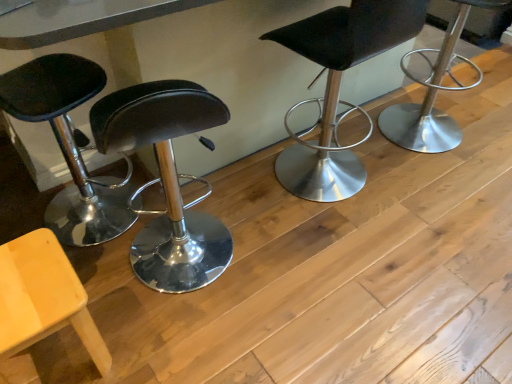
Question: Does polished silver stool at right, the first chair positioned from the right, have a lesser height compared to black leather stool at center, positioned as the 2th chair in right-to-left order?

Choices:
 (A) no
 (B) yes

Answer: (B)

Question: Is polished silver stool at right, the 4th chair in the left-to-right sequence, behind black leather stool at center, positioned as the 2th chair in right-to-left order?

Choices:
 (A) yes
 (B) no

Answer: (A)

Question: Is polished silver stool at right, the 4th chair in the left-to-right sequence, not close to black leather stool at center, positioned as the 2th chair in right-to-left order?

Choices:
 (A) no
 (B) yes

Answer: (A)

Question: Does polished silver stool at right, the 4th chair in the left-to-right sequence, have a larger size compared to black leather stool at center, positioned as the 2th chair in right-to-left order?

Choices:
 (A) yes
 (B) no

Answer: (B)

Question: Can you confirm if polished silver stool at right, the 4th chair in the left-to-right sequence, is wider than black leather stool at center, the 3th chair in the left-to-right sequence?

Choices:
 (A) yes
 (B) no

Answer: (A)

Question: Is point (342, 48) positioned closer to the camera than point (421, 147)?

Choices:
 (A) farther
 (B) closer

Answer: (B)

Question: Looking at the image, does black leather stool at center, positioned as the 2th chair in right-to-left order, seem bigger or smaller compared to polished silver stool at right, the first chair positioned from the right?

Choices:
 (A) big
 (B) small

Answer: (A)

Question: Is black leather stool at center, positioned as the 2th chair in right-to-left order, to the left or to the right of polished silver stool at right, the first chair positioned from the right, in the image?

Choices:
 (A) right
 (B) left

Answer: (B)

Question: In terms of height, does black leather stool at center, positioned as the 2th chair in right-to-left order, look taller or shorter compared to polished silver stool at right, the 4th chair in the left-to-right sequence?

Choices:
 (A) tall
 (B) short

Answer: (A)

Question: Looking at the image, does matte black stool at left, which appears as the 1th chair when viewed from the left, seem bigger or smaller compared to polished silver stool at right, the first chair positioned from the right?

Choices:
 (A) big
 (B) small

Answer: (A)

Question: From the image's perspective, is matte black stool at left, arranged as the fourth chair when viewed from the right, located above or below polished silver stool at right, the first chair positioned from the right?

Choices:
 (A) above
 (B) below

Answer: (B)

Question: Visually, is matte black stool at left, which appears as the 1th chair when viewed from the left, positioned to the left or to the right of polished silver stool at right, the 4th chair in the left-to-right sequence?

Choices:
 (A) right
 (B) left

Answer: (B)

Question: Is matte black stool at left, which appears as the 1th chair when viewed from the left, in front of or behind polished silver stool at right, the 4th chair in the left-to-right sequence, in the image?

Choices:
 (A) front
 (B) behind

Answer: (A)

Question: Considering their positions, is polished silver stool at right, the 4th chair in the left-to-right sequence, located in front of or behind black leather stool at center, the 3th chair in the left-to-right sequence?

Choices:
 (A) front
 (B) behind

Answer: (B)

Question: In terms of height, does polished silver stool at right, the first chair positioned from the right, look taller or shorter compared to black leather stool at center, the 3th chair in the left-to-right sequence?

Choices:
 (A) tall
 (B) short

Answer: (B)